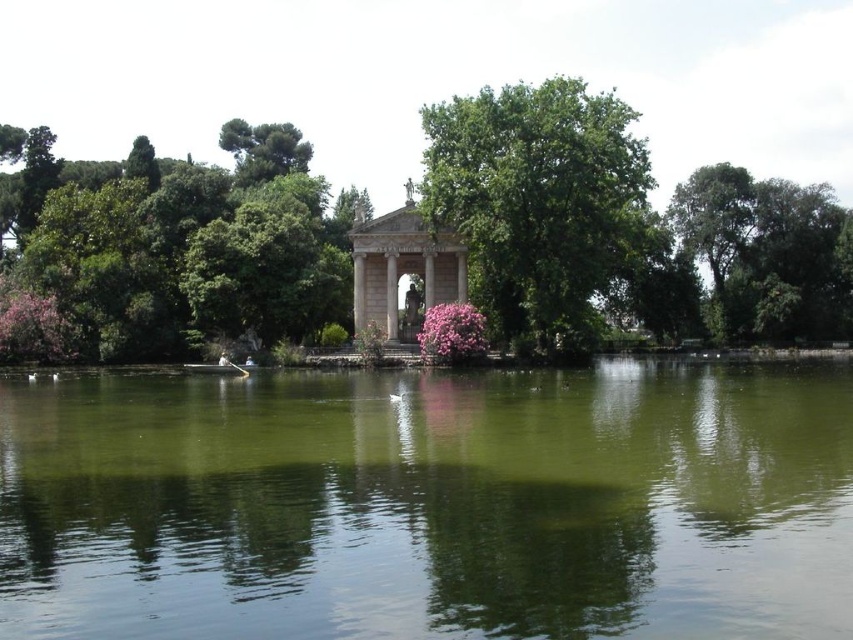
Question: Can you confirm if green leafy tree at center is positioned to the left of green leafy tree at upper right?

Choices:
 (A) yes
 (B) no

Answer: (A)

Question: Does green reflective water at center appear under green leafy tree at left?

Choices:
 (A) yes
 (B) no

Answer: (A)

Question: Which object is closer to the camera taking this photo?

Choices:
 (A) green leafy tree at center
 (B) green reflective water at center
 (C) green leafy tree at left

Answer: (B)

Question: Considering the relative positions of green leafy tree at left and green leafy tree at upper right in the image provided, where is green leafy tree at left located with respect to green leafy tree at upper right?

Choices:
 (A) left
 (B) right

Answer: (A)

Question: Which point is farther to the camera?

Choices:
 (A) (469, 241)
 (B) (425, 280)

Answer: (B)

Question: Which point appears closest to the camera in this image?

Choices:
 (A) (427, 268)
 (B) (763, 205)
 (C) (352, 384)

Answer: (C)